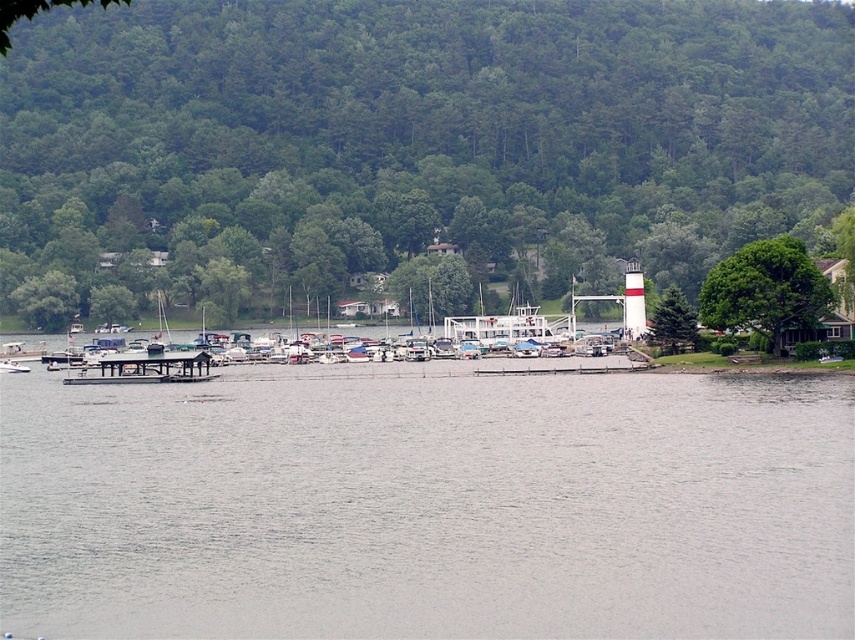
You are standing at the point with coordinates (x=426, y=506) in the scene. Based on the description, what is the color of the surface you are currently standing on?

The point at coordinates (x=426, y=506) indicates gray water at center, so the surface you are standing on is gray water.